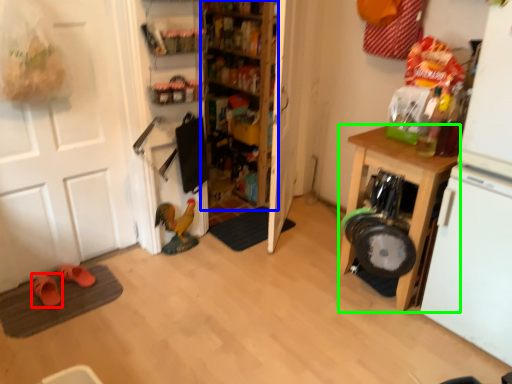
Question: Which is nearer to the footwear (highlighted by a red box)? shelf (highlighted by a blue box) or cabinetry (highlighted by a green box).

Choices:
 (A) shelf
 (B) cabinetry

Answer: (A)